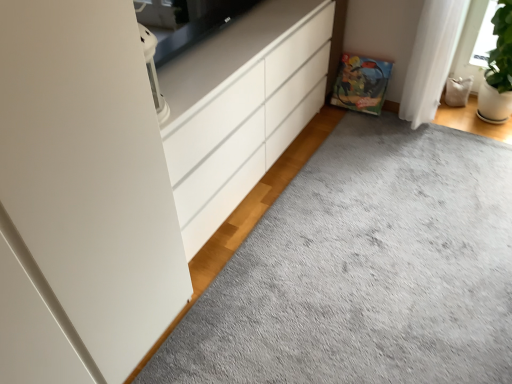
Question: Is point (228, 77) positioned closer to the camera than point (193, 326)?

Choices:
 (A) farther
 (B) closer

Answer: (B)

Question: From the image's perspective, is white glossy chest of drawers at center above or below gray soft carpet at center?

Choices:
 (A) below
 (B) above

Answer: (B)

Question: In the image, is white glossy chest of drawers at center positioned in front of or behind gray soft carpet at center?

Choices:
 (A) front
 (B) behind

Answer: (B)

Question: From the image's perspective, is gray soft carpet at center above or below white glossy chest of drawers at center?

Choices:
 (A) below
 (B) above

Answer: (A)

Question: Is gray soft carpet at center taller or shorter than white glossy chest of drawers at center?

Choices:
 (A) short
 (B) tall

Answer: (A)

Question: Considering the positions of point (223, 354) and point (228, 205), is point (223, 354) closer or farther from the camera than point (228, 205)?

Choices:
 (A) farther
 (B) closer

Answer: (B)

Question: Based on their sizes in the image, would you say gray soft carpet at center is bigger or smaller than white glossy chest of drawers at center?

Choices:
 (A) big
 (B) small

Answer: (B)